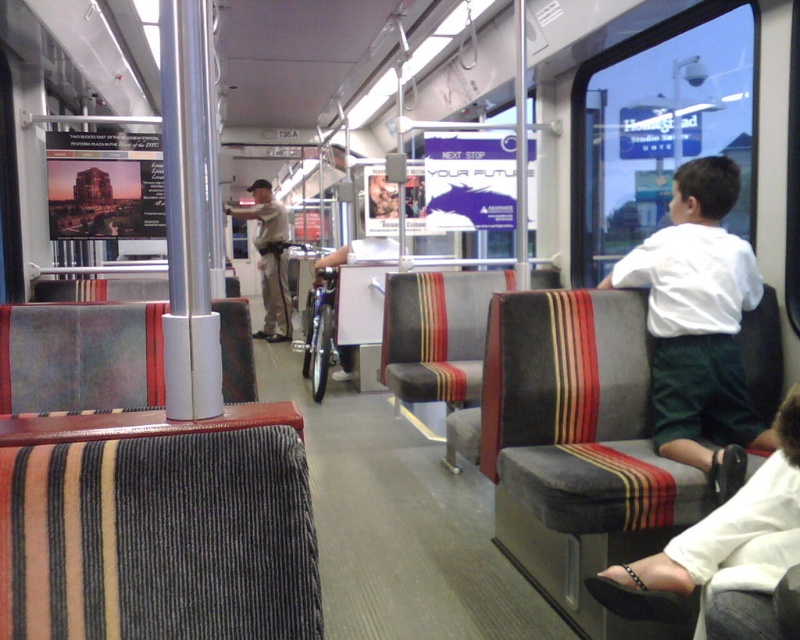
Question: Among these points, which one is nearest to the camera?

Choices:
 (A) (x=740, y=442)
 (B) (x=254, y=180)
 (C) (x=745, y=608)

Answer: (C)

Question: Is white fabric shoe at lower right to the left of khaki uniform at center from the viewer's perspective?

Choices:
 (A) no
 (B) yes

Answer: (A)

Question: Among these objects, which one is nearest to the camera?

Choices:
 (A) white fabric shoe at lower right
 (B) white cotton shirt at right

Answer: (A)

Question: Is white cotton shirt at right bigger than white fabric shoe at lower right?

Choices:
 (A) yes
 (B) no

Answer: (A)

Question: Considering the real-world distances, which object is farthest from the white fabric shoe at lower right?

Choices:
 (A) white cotton shirt at right
 (B) khaki uniform at center

Answer: (B)

Question: Is white cotton shirt at right bigger than white fabric shoe at lower right?

Choices:
 (A) yes
 (B) no

Answer: (A)